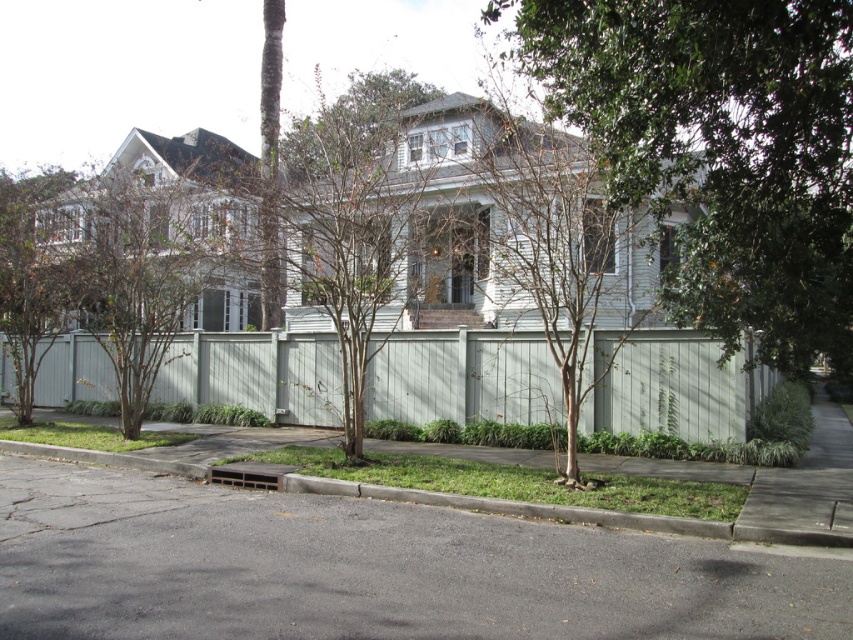
Between brown textured tree at center and brown leafy tree at center, which one appears on the right side from the viewer's perspective?

Positioned to the right is brown textured tree at center.

Is brown textured tree at center further to the viewer compared to brown leafy tree at center?

No.

I want to click on brown textured tree at center, so click(550, 240).

Who is taller, brown textured tree at center or gray concrete curb at lower center?

With more height is brown textured tree at center.

Is brown textured tree at center below gray concrete curb at lower center?

Incorrect, brown textured tree at center is not positioned below gray concrete curb at lower center.

Find the location of a particular element. brown textured tree at center is located at coordinates (550, 240).

Which is below, brown leafy tree at center or gray concrete curb at lower center?

Positioned lower is gray concrete curb at lower center.

Who is positioned more to the right, brown leafy tree at center or gray concrete curb at lower center?

Positioned to the right is gray concrete curb at lower center.

Is point (138, 316) closer to viewer compared to point (55, 445)?

No, (138, 316) is further to viewer.

This screenshot has width=853, height=640. Find the location of `brown leafy tree at center`. brown leafy tree at center is located at coordinates (132, 268).